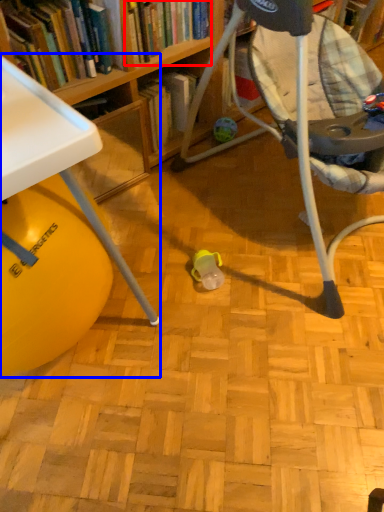
Question: Which point is closer to the camera, book (highlighted by a red box) or table (highlighted by a blue box)?

Choices:
 (A) book
 (B) table

Answer: (B)